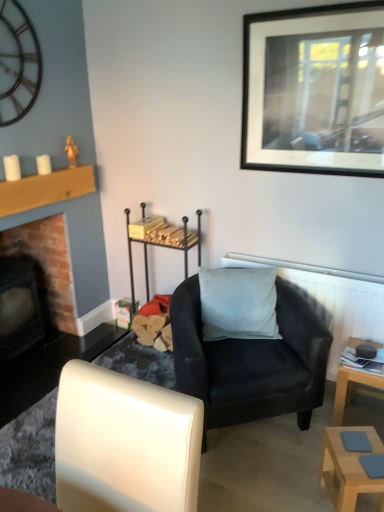
Question: From the image's perspective, is matte black armchair at center, the first chair positioned from the back, above white textured radiator at upper right?

Choices:
 (A) no
 (B) yes

Answer: (A)

Question: Is matte black armchair at center, the 2th chair positioned from the front, taller than white textured radiator at upper right?

Choices:
 (A) no
 (B) yes

Answer: (B)

Question: From a real-world perspective, is matte black armchair at center, the 2th chair positioned from the front, located beneath white textured radiator at upper right?

Choices:
 (A) yes
 (B) no

Answer: (A)

Question: Is matte black armchair at center, the 2th chair positioned from the front, surrounding white textured radiator at upper right?

Choices:
 (A) no
 (B) yes

Answer: (A)

Question: Can you confirm if matte black armchair at center, the 2th chair positioned from the front, is thinner than white textured radiator at upper right?

Choices:
 (A) no
 (B) yes

Answer: (A)

Question: Does matte black armchair at center, the 2th chair positioned from the front, appear on the left side of white textured radiator at upper right?

Choices:
 (A) yes
 (B) no

Answer: (A)

Question: From a real-world perspective, is brick fireplace at left over black matte picture frame at upper right?

Choices:
 (A) no
 (B) yes

Answer: (A)

Question: Is brick fireplace at left not within black matte picture frame at upper right?

Choices:
 (A) no
 (B) yes

Answer: (B)

Question: Are brick fireplace at left and black matte picture frame at upper right beside each other?

Choices:
 (A) no
 (B) yes

Answer: (A)

Question: From the image's perspective, is brick fireplace at left above black matte picture frame at upper right?

Choices:
 (A) yes
 (B) no

Answer: (B)

Question: Does brick fireplace at left appear on the left side of black matte picture frame at upper right?

Choices:
 (A) no
 (B) yes

Answer: (B)

Question: Does brick fireplace at left appear on the right side of black matte picture frame at upper right?

Choices:
 (A) no
 (B) yes

Answer: (A)

Question: Considering the relative sizes of matte black armchair at center, the first chair positioned from the back, and white leather chair at lower left, the 2th chair when ordered from back to front, in the image provided, is matte black armchair at center, the first chair positioned from the back, wider than white leather chair at lower left, the 2th chair when ordered from back to front,?

Choices:
 (A) yes
 (B) no

Answer: (A)